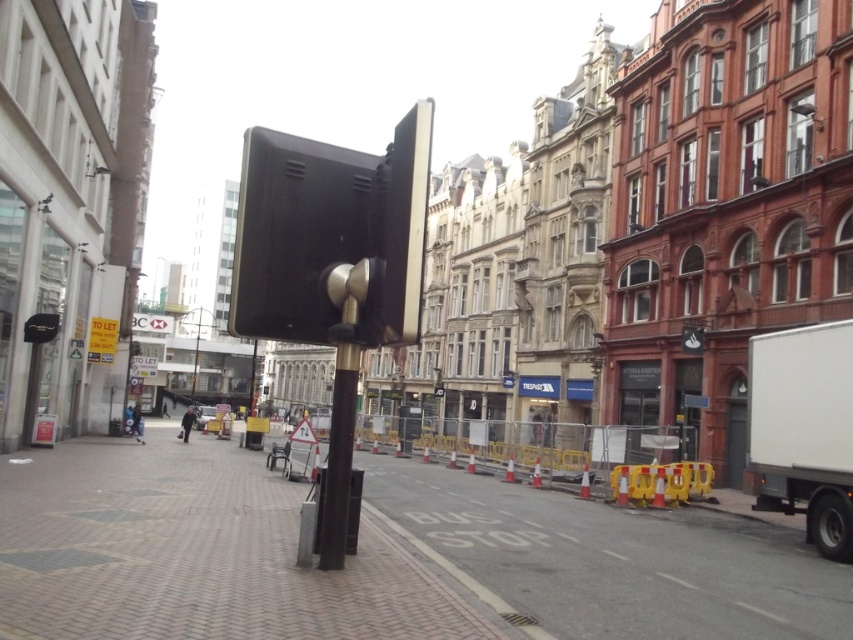
Locate an element on the screen. The width and height of the screenshot is (853, 640). black plastic traffic light at center is located at coordinates (331, 237).

Between black plastic traffic light at center and black matte pole at center, which one has less height?

Standing shorter between the two is black matte pole at center.

The height and width of the screenshot is (640, 853). What do you see at coordinates (331, 237) in the screenshot?
I see `black plastic traffic light at center` at bounding box center [331, 237].

Identify the location of black plastic traffic light at center. (331, 237).

Does brick pavement at center appear over black plastic traffic light at center?

No, brick pavement at center is not above black plastic traffic light at center.

Image resolution: width=853 pixels, height=640 pixels. Describe the element at coordinates (193, 552) in the screenshot. I see `brick pavement at center` at that location.

The image size is (853, 640). Find the location of `brick pavement at center`. brick pavement at center is located at coordinates (193, 552).

Is brick pavement at center shorter than black matte pole at center?

No, brick pavement at center is not shorter than black matte pole at center.

Find the location of a particular element. brick pavement at center is located at coordinates (193, 552).

At what (x,y) coordinates should I click in order to perform the action: click on brick pavement at center. Please return your answer as a coordinate pair (x, y). Looking at the image, I should click on (193, 552).